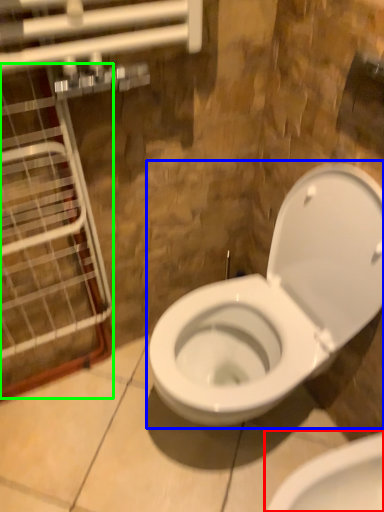
Question: Which object is positioned closest to toilet (highlighted by a red box)? Select from toilet (highlighted by a blue box) and glass door (highlighted by a green box).

Choices:
 (A) toilet
 (B) glass door

Answer: (A)